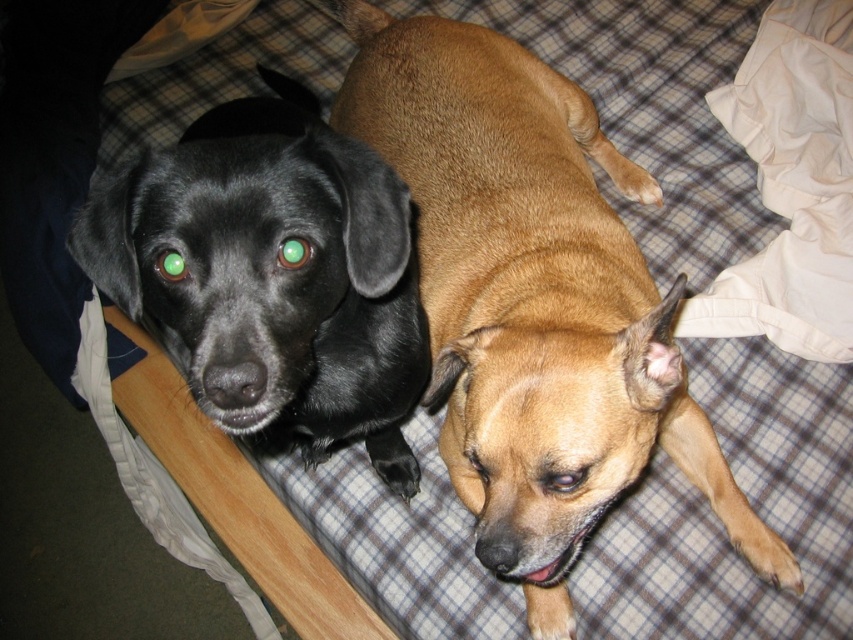
Between brown matte dog at center and shiny black dog at left, which one appears on the left side from the viewer's perspective?

shiny black dog at left

Does brown matte dog at center appear over shiny black dog at left?

Correct, brown matte dog at center is located above shiny black dog at left.

The width and height of the screenshot is (853, 640). I want to click on brown matte dog at center, so click(x=532, y=300).